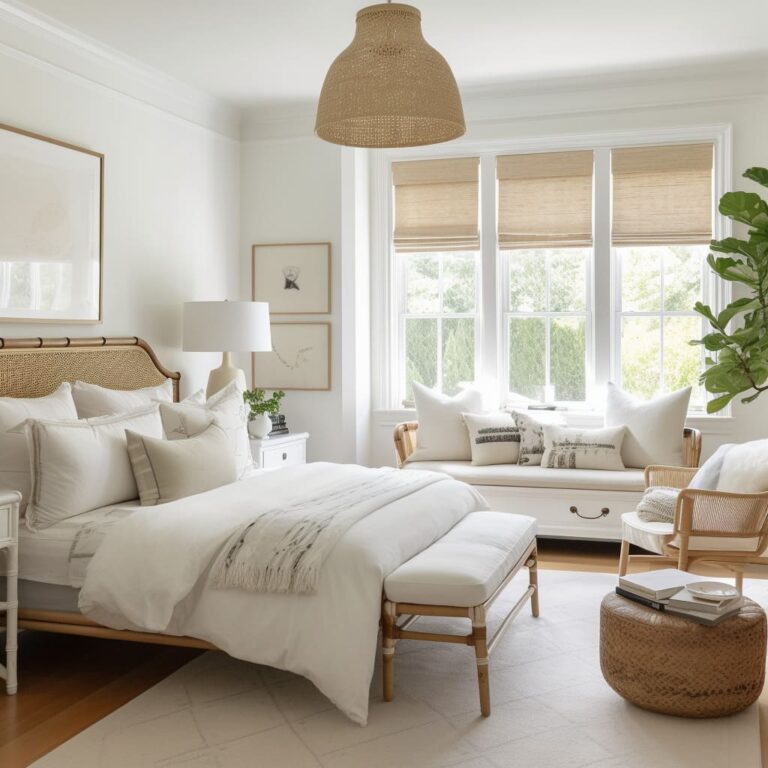
Identify the location of white carpet. (551, 702).